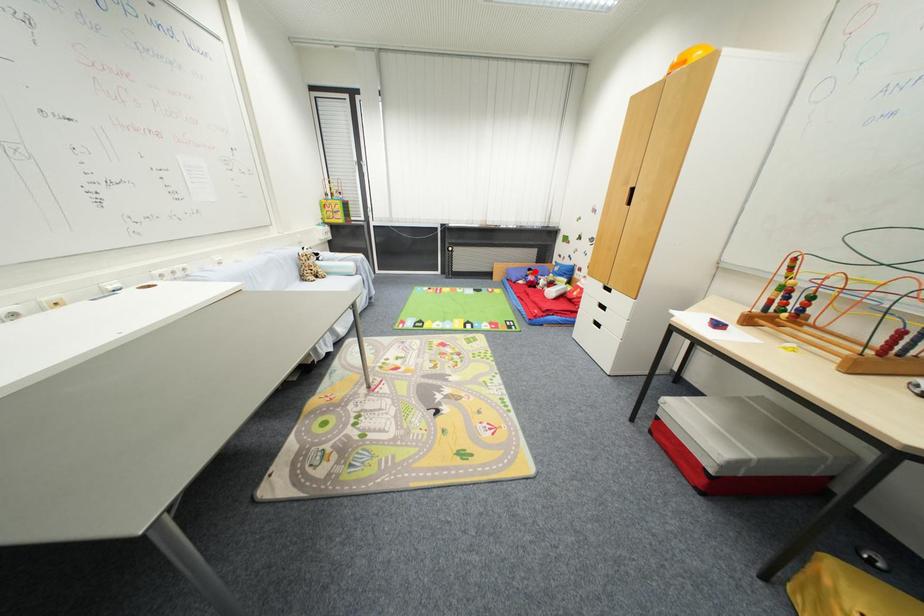
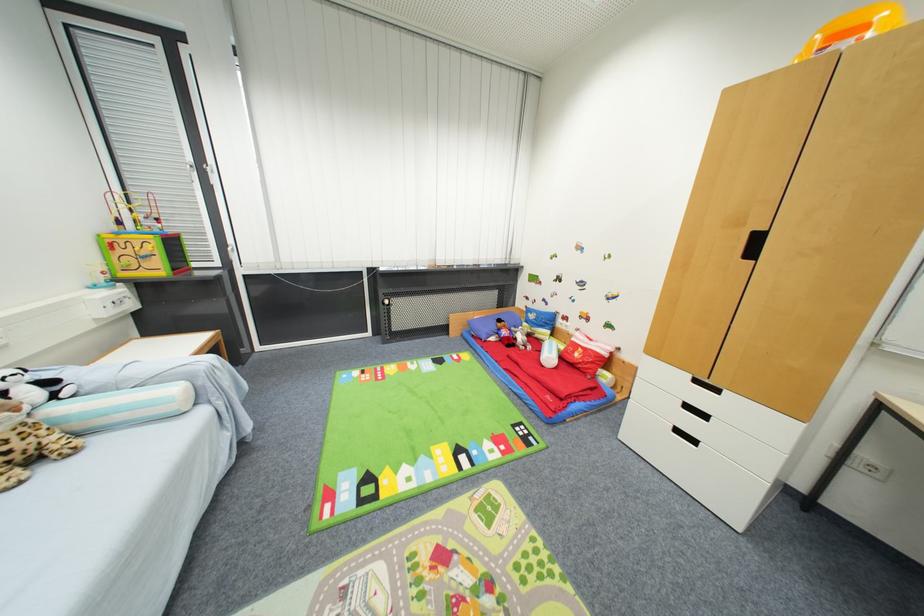
Locate, in the second image, the point that corresponds to the highlighted location in the first image.

(505, 323)